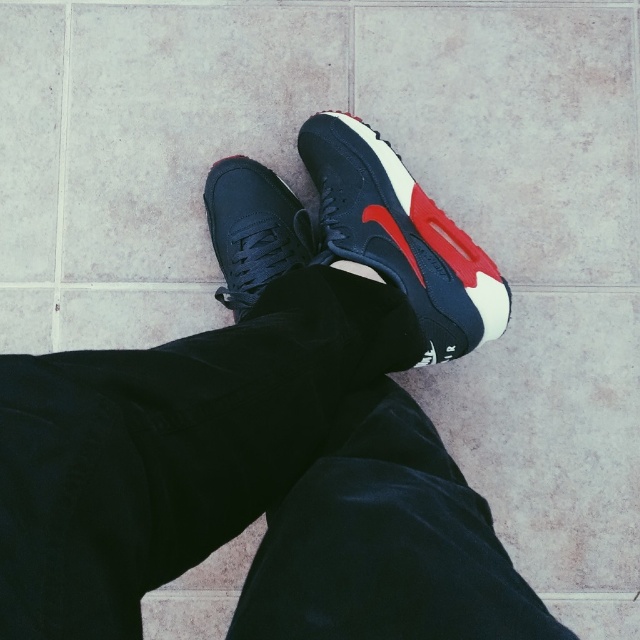
Is point (257, 61) positioned in front of point (269, 260)?

No.

Does matte black shoe at center have a lesser width compared to matte black sneaker at center?

No, matte black shoe at center is not thinner than matte black sneaker at center.

You are a GUI agent. You are given a task and a screenshot of the screen. Output one action in this format:
    pyautogui.click(x=<x>, y=<y>)
    Task: Click on the matte black shoe at center
    
    Given the screenshot: What is the action you would take?
    pyautogui.click(x=180, y=124)

Is point (54, 97) positioned after point (378, 278)?

Yes.

Can you confirm if white matte tile at upper left is thinner than white soft sock at center?

No.

Where is `white matte tile at upper left`? Image resolution: width=640 pixels, height=640 pixels. white matte tile at upper left is located at coordinates (28, 138).

Between point (141, 227) and point (364, 212), which one is positioned behind?

Positioned behind is point (141, 227).

Can you confirm if matte black shoe at center is wider than matte leather sneaker at center?

Indeed, matte black shoe at center has a greater width compared to matte leather sneaker at center.

Is point (99, 97) closer to viewer compared to point (397, 218)?

No, it is not.

The width and height of the screenshot is (640, 640). What are the coordinates of `matte black shoe at center` in the screenshot? It's located at (180, 124).